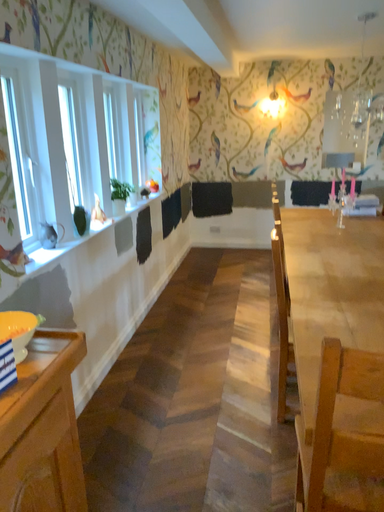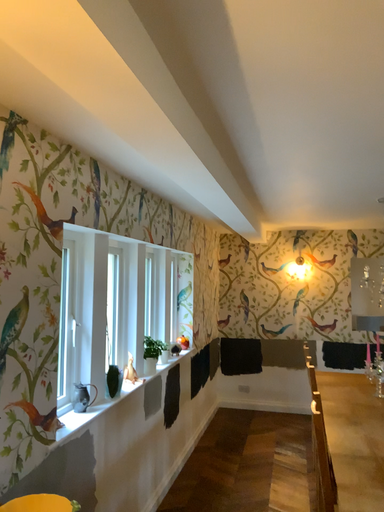
Question: How did the camera likely rotate when shooting the video?

Choices:
 (A) rotated downward
 (B) rotated upward

Answer: (B)